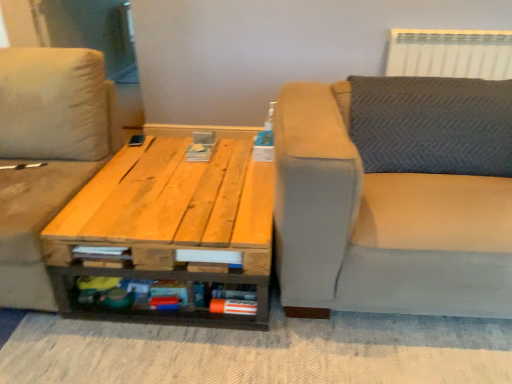
Question: From the image's perspective, is light gray fabric couch at right, arranged as the second studio couch when viewed from the left, above or below natural wood table at center?

Choices:
 (A) below
 (B) above

Answer: (B)

Question: In terms of size, does light gray fabric couch at right, arranged as the second studio couch when viewed from the left, appear bigger or smaller than natural wood table at center?

Choices:
 (A) small
 (B) big

Answer: (B)

Question: Estimate the real-world distances between objects in this image. Which object is farther from the beige fabric studio couch at left, placed as the 2th studio couch when sorted from right to left?

Choices:
 (A) light gray fabric couch at right, arranged as the second studio couch when viewed from the left
 (B) natural wood table at center
 (C) white plastic radiator at upper right

Answer: (C)

Question: Which is nearer to the beige fabric studio couch at left, placed as the 2th studio couch when sorted from right to left?

Choices:
 (A) natural wood table at center
 (B) light gray fabric couch at right, the first studio couch viewed from the right
 (C) white plastic radiator at upper right

Answer: (A)